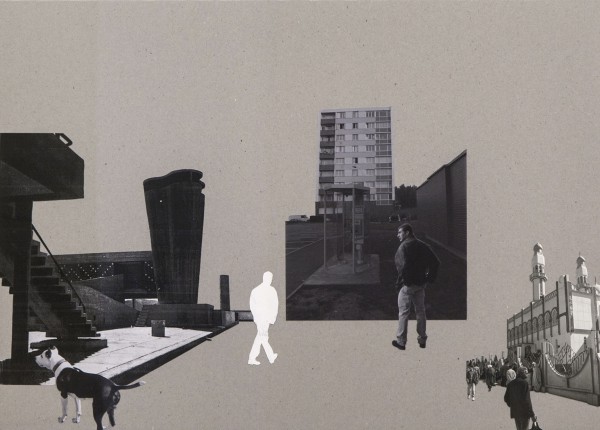
Where is `flight of stairs`? flight of stairs is located at coordinates (49, 283).